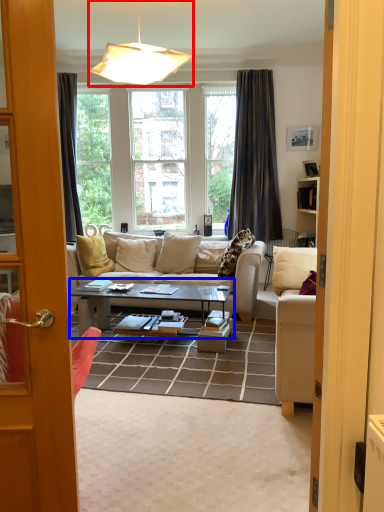
Question: Which object appears closest to the camera in this image, lamp (highlighted by a red box) or coffee table (highlighted by a blue box)?

Choices:
 (A) lamp
 (B) coffee table

Answer: (A)